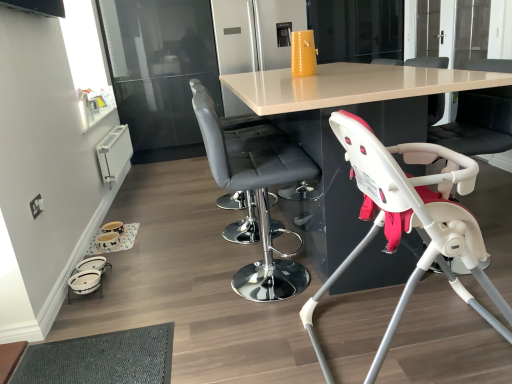
What do you see at coordinates (256, 195) in the screenshot?
I see `matte gray bar stool at center, which appears as the 3th chair when viewed from the back` at bounding box center [256, 195].

The width and height of the screenshot is (512, 384). What do you see at coordinates (240, 127) in the screenshot?
I see `matte gray bar stool at center, placed as the 1th chair when sorted from left to right` at bounding box center [240, 127].

What is the approximate width of white plastic highchair at lower right, acting as the 2th chair starting from the right?

71.21 centimeters.

Find the location of a particular element. The width and height of the screenshot is (512, 384). matte gray bar stool at center, placed as the 3th chair when sorted from right to left is located at coordinates (256, 195).

Looking at this image, does matte gray bar stool at center, which is counted as the third chair, starting from the front, have a smaller size compared to white plastic baby carriage at lower left?

No, matte gray bar stool at center, which is counted as the third chair, starting from the front, is not smaller than white plastic baby carriage at lower left.

Which is behind, point (242, 123) or point (76, 294)?

Positioned behind is point (242, 123).

Which of these two, matte gray bar stool at center, the 2th chair in the back-to-front sequence, or white plastic baby carriage at lower left, is wider?

matte gray bar stool at center, the 2th chair in the back-to-front sequence, is wider.

Visually, is matte gray bar stool at center, which is counted as the third chair, starting from the front, positioned to the left or to the right of white plastic baby carriage at lower left?

Clearly, matte gray bar stool at center, which is counted as the third chair, starting from the front, is on the right of white plastic baby carriage at lower left in the image.

From the image's perspective, is black leather chair at right, the fourth chair from the front, above matte gray bar stool at center, which is counted as the third chair, starting from the front?

Yes, from the image's perspective, black leather chair at right, the fourth chair from the front, is above matte gray bar stool at center, which is counted as the third chair, starting from the front.

Is point (499, 143) positioned behind point (242, 198)?

No, (499, 143) is in front of (242, 198).

Does black leather chair at right, the fourth chair from the front, have a larger size compared to matte gray bar stool at center, which is counted as the third chair, starting from the front?

Incorrect, black leather chair at right, the fourth chair from the front, is not larger than matte gray bar stool at center, which is counted as the third chair, starting from the front.

How much distance is there between black leather chair at right, the fourth chair from the front, and matte gray bar stool at center, positioned as the 4th chair in right-to-left order?

36.95 inches.

How different are the orientations of matte white table at center and matte gray bar stool at center, which appears as the 3th chair when viewed from the back, in degrees?

They differ by 1.33 degrees in their facing directions.

Is matte white table at center thinner than matte gray bar stool at center, which appears as the 3th chair when viewed from the back?

No.

Can you confirm if matte white table at center is shorter than matte gray bar stool at center, placed as the 3th chair when sorted from right to left?

No, matte white table at center is not shorter than matte gray bar stool at center, placed as the 3th chair when sorted from right to left.

Between point (445, 81) and point (242, 271), which one is positioned in front?

The point (445, 81) is more forward.

Between matte gray bar stool at center, which appears as the 3th chair when viewed from the back, and black leather chair at right, positioned as the first chair in back-to-front order, which one has smaller width?

With smaller width is black leather chair at right, positioned as the first chair in back-to-front order.

Can you tell me how much matte gray bar stool at center, which appears as the 3th chair when viewed from the back, and black leather chair at right, the fourth chair from the front, differ in facing direction?

They differ by 179 degrees in their facing directions.

Could you tell me if matte gray bar stool at center, positioned as the second chair in left-to-right order, is facing black leather chair at right, positioned as the first chair in back-to-front order?

No, matte gray bar stool at center, positioned as the second chair in left-to-right order, does not turn towards black leather chair at right, positioned as the first chair in back-to-front order.

Which point is more distant from viewer, (341, 67) or (100, 267)?

Point (341, 67)

Is matte white table at center in contact with white plastic baby carriage at lower left?

No, matte white table at center is not in contact with white plastic baby carriage at lower left.

Considering the sizes of objects matte white table at center and white plastic baby carriage at lower left in the image provided, who is bigger, matte white table at center or white plastic baby carriage at lower left?

With larger size is matte white table at center.

Is matte white table at center oriented towards white plastic baby carriage at lower left?

No, matte white table at center is not facing towards white plastic baby carriage at lower left.

Is matte gray bar stool at center, which appears as the 3th chair when viewed from the back, a part of matte gray bar stool at center, positioned as the 4th chair in right-to-left order?

Actually, matte gray bar stool at center, which appears as the 3th chair when viewed from the back, is outside matte gray bar stool at center, positioned as the 4th chair in right-to-left order.

Is matte gray bar stool at center, positioned as the 4th chair in right-to-left order, turned away from matte gray bar stool at center, placed as the second chair when sorted from front to back?

That's not correct — matte gray bar stool at center, positioned as the 4th chair in right-to-left order, is not looking away from matte gray bar stool at center, placed as the second chair when sorted from front to back.

Is matte gray bar stool at center, placed as the 1th chair when sorted from left to right, positioned before matte gray bar stool at center, placed as the second chair when sorted from front to back?

No, it is not.

Based on the photo, which is further, [215,174] or [288,171]?

The point [288,171] is farther.

Considering the positions of objects white plastic baby carriage at lower left and matte white table at center in the image provided, who is more to the right, white plastic baby carriage at lower left or matte white table at center?

Positioned to the right is matte white table at center.

Considering the sizes of objects white plastic baby carriage at lower left and matte white table at center in the image provided, who is taller, white plastic baby carriage at lower left or matte white table at center?

matte white table at center.

Find the location of a particular element. baby carriage that appears on the left of matte white table at center is located at coordinates (87, 277).

Does white plastic baby carriage at lower left come behind matte white table at center?

Yes, white plastic baby carriage at lower left is further from the viewer.

Find the location of a particular element. The width and height of the screenshot is (512, 384). chair that is the 1st one when counting backward from the white plastic baby carriage at lower left is located at coordinates (240, 127).

Locate an element on the screen. chair above the matte gray bar stool at center, which is counted as the third chair, starting from the front (from the image's perspective) is located at coordinates (478, 123).

When comparing their distances from matte gray bar stool at center, the 2th chair in the back-to-front sequence, does white plastic highchair at lower right, acting as the 2th chair starting from the right, or matte gray bar stool at center, placed as the second chair when sorted from front to back, seem further?

The object further to matte gray bar stool at center, the 2th chair in the back-to-front sequence, is white plastic highchair at lower right, acting as the 2th chair starting from the right.

When comparing their distances from white plastic highchair at lower right, acting as the 2th chair starting from the right, does matte gray bar stool at center, placed as the second chair when sorted from front to back, or matte white table at center seem closer?

Among the two, matte white table at center is located nearer to white plastic highchair at lower right, acting as the 2th chair starting from the right.

When comparing their distances from matte gray bar stool at center, placed as the 3th chair when sorted from right to left, does black leather chair at right, positioned as the 1th chair in right-to-left order, or white plastic baby carriage at lower left seem closer?

black leather chair at right, positioned as the 1th chair in right-to-left order.

From the image, which object appears to be nearer to black leather chair at right, the fourth chair positioned from the left, matte gray bar stool at center, placed as the 1th chair when sorted from left to right, or matte white table at center?

matte white table at center lies closer to black leather chair at right, the fourth chair positioned from the left, than the other object.

Which object lies nearer to the anchor point matte gray bar stool at center, positioned as the 4th chair in right-to-left order, matte white table at center or black leather chair at right, the fourth chair positioned from the left?

matte white table at center lies closer to matte gray bar stool at center, positioned as the 4th chair in right-to-left order, than the other object.

When comparing their distances from matte gray bar stool at center, which appears as the 3th chair when viewed from the back, does matte gray bar stool at center, placed as the 1th chair when sorted from left to right, or white plastic highchair at lower right, the third chair when ordered from left to right, seem further?

white plastic highchair at lower right, the third chair when ordered from left to right, lies further to matte gray bar stool at center, which appears as the 3th chair when viewed from the back, than the other object.

Based on their spatial positions, is matte gray bar stool at center, which appears as the 3th chair when viewed from the back, or white plastic baby carriage at lower left further from black leather chair at right, positioned as the 1th chair in right-to-left order?

Based on the image, white plastic baby carriage at lower left appears to be further to black leather chair at right, positioned as the 1th chair in right-to-left order.

From the image, which object appears to be farther from matte gray bar stool at center, placed as the 3th chair when sorted from right to left, white plastic baby carriage at lower left or black leather chair at right, the fourth chair positioned from the left?

The object further to matte gray bar stool at center, placed as the 3th chair when sorted from right to left, is white plastic baby carriage at lower left.

Identify the location of table between matte gray bar stool at center, the 2th chair in the back-to-front sequence, and black leather chair at right, positioned as the 1th chair in right-to-left order, in the horizontal direction. (349, 86).

I want to click on chair positioned between matte white table at center and matte gray bar stool at center, positioned as the 4th chair in right-to-left order, from near to far, so click(x=256, y=195).

Where is `table between white plastic baby carriage at lower left and black leather chair at right, positioned as the first chair in back-to-front order, in the horizontal direction`? table between white plastic baby carriage at lower left and black leather chair at right, positioned as the first chair in back-to-front order, in the horizontal direction is located at coordinates (349, 86).

This screenshot has height=384, width=512. What are the coordinates of `table positioned between white plastic highchair at lower right, the third chair when ordered from left to right, and matte gray bar stool at center, which appears as the 3th chair when viewed from the back, from near to far` in the screenshot? It's located at (349, 86).